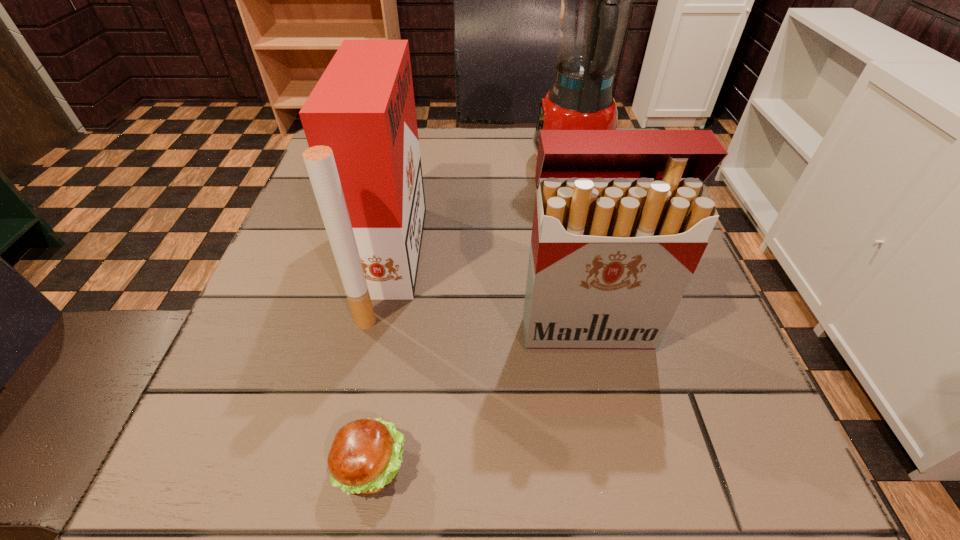
Find the location of `vacant space located 0.130m with the lid open on the right cigarette case`. vacant space located 0.130m with the lid open on the right cigarette case is located at coordinates (609, 437).

You are a GUI agent. You are given a task and a screenshot of the screen. Output one action in this format:
    pyautogui.click(x=<x>, y=<y>)
    Task: Click on the vacant space located 0.110m on the left of the shortest object
    
    Given the screenshot: What is the action you would take?
    pyautogui.click(x=246, y=467)

Where is `object at the far edge`? object at the far edge is located at coordinates (x=596, y=0).

Find the location of `object that is positioned at the near edge`. object that is positioned at the near edge is located at coordinates (364, 458).

Image resolution: width=960 pixels, height=540 pixels. In order to click on food processor at the right edge in this screenshot , I will do `click(596, 0)`.

This screenshot has height=540, width=960. Identify the location of cigarette case that is at the right edge. (622, 218).

Image resolution: width=960 pixels, height=540 pixels. What are the coordinates of `object positioned at the far right corner` in the screenshot? It's located at (596, 0).

In the image, there is a desktop. In order to click on vacant space at the far edge in this screenshot , I will do `click(494, 150)`.

Where is `vacant space at the near edge of the desktop`? The width and height of the screenshot is (960, 540). vacant space at the near edge of the desktop is located at coordinates [390, 517].

Where is `free space at the left edge`? free space at the left edge is located at coordinates (278, 370).